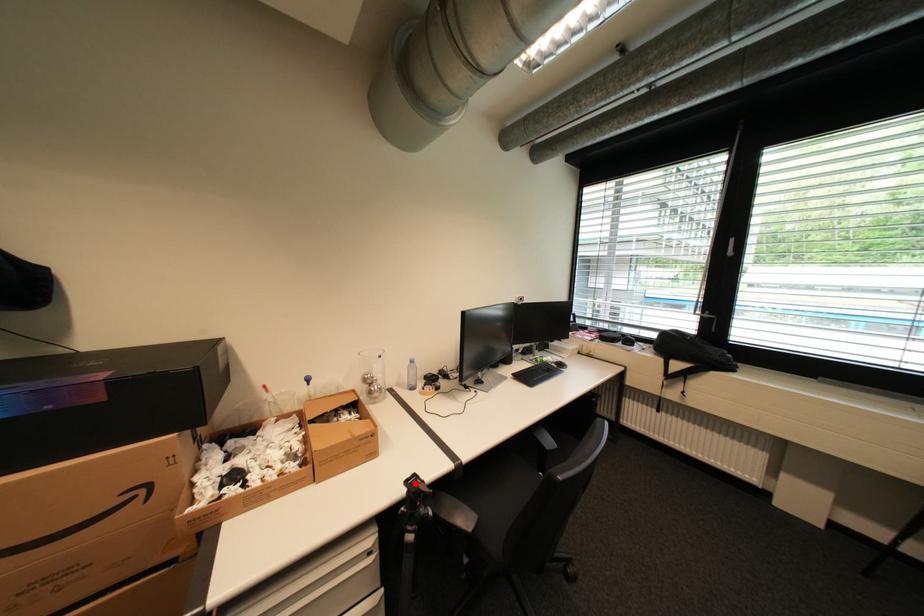
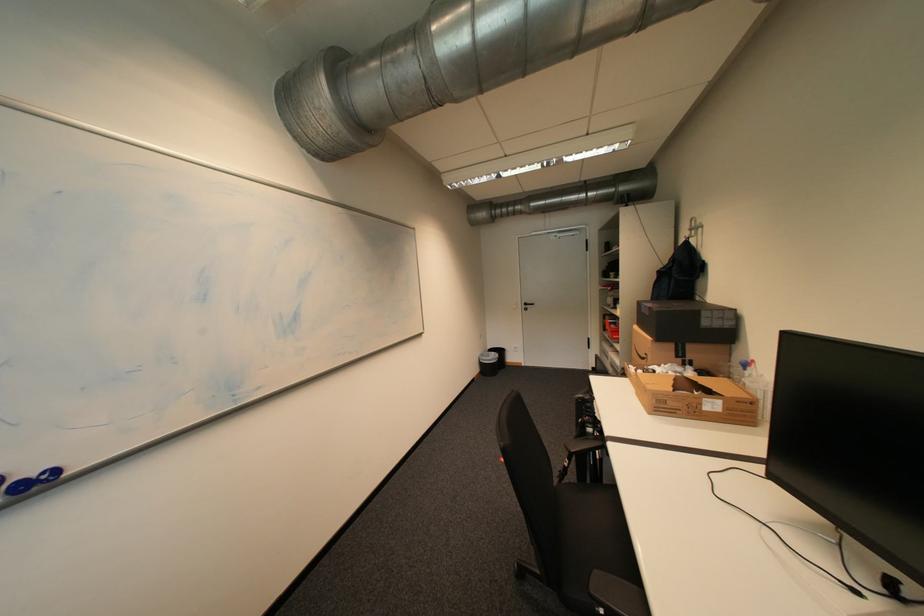
Question: I am providing you with two images of the same scene from different viewpoints. A red point is marked on the first image. Can you still see the location of the red point in image 2?

Choices:
 (A) Yes
 (B) No

Answer: (B)